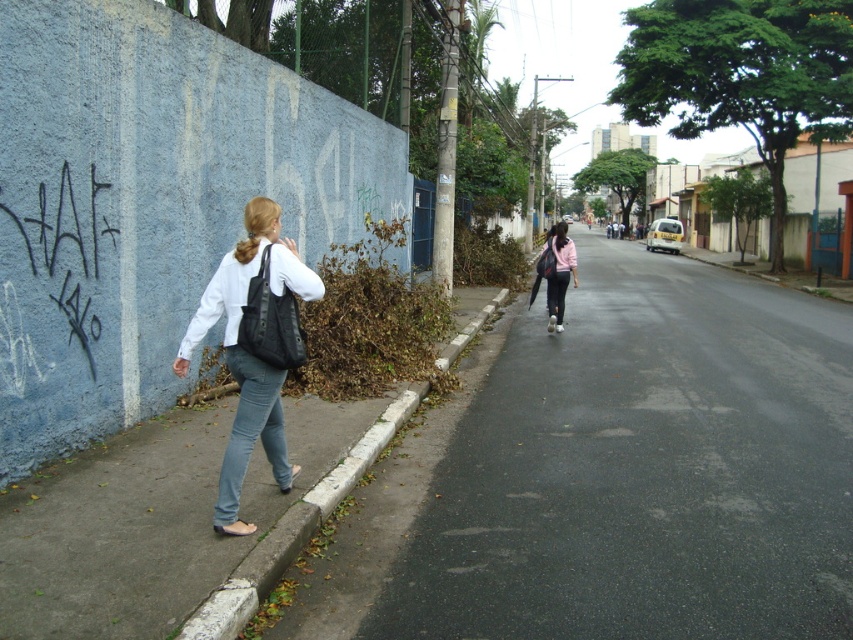
Question: Which object appears farthest from the camera in this image?

Choices:
 (A) gray concrete curb at lower left
 (B) asphalt at center
 (C) matte black bag at left

Answer: (C)

Question: Among these objects, which one is nearest to the camera?

Choices:
 (A) matte black bag at left
 (B) gray concrete curb at lower left
 (C) pink matte jacket at center

Answer: (B)

Question: Considering the relative positions of gray concrete curb at lower left and denim jeans at lower left in the image provided, where is gray concrete curb at lower left located with respect to denim jeans at lower left?

Choices:
 (A) left
 (B) right

Answer: (B)

Question: Is matte black bag at left smaller than denim jeans at lower left?

Choices:
 (A) no
 (B) yes

Answer: (A)

Question: Is asphalt at center positioned behind matte black bag at left?

Choices:
 (A) yes
 (B) no

Answer: (B)

Question: Among these points, which one is nearest to the camera?

Choices:
 (A) (543, 244)
 (B) (252, 266)
 (C) (813, 429)

Answer: (B)